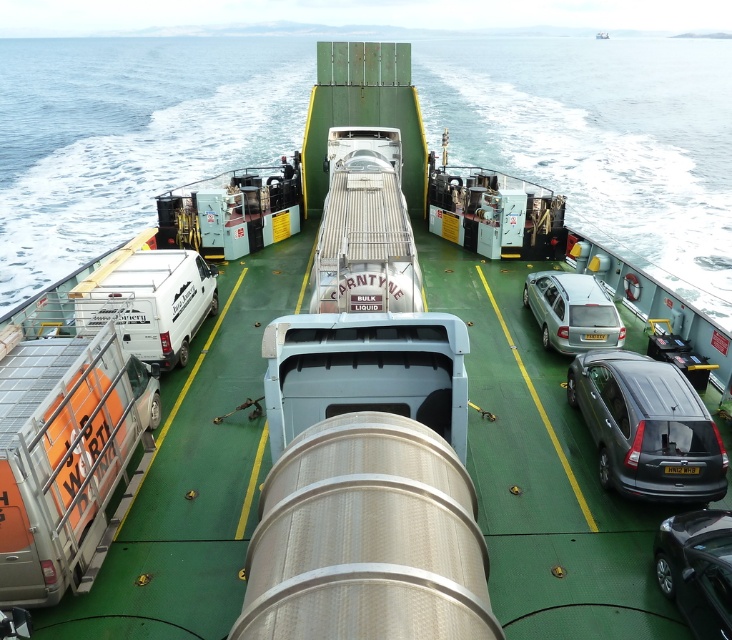
You are a passenger on the ferry and want to take a photo of the shiny black sedan at lower right and the yellow plastic license plate at center. Which object should you point your camera towards first if you want to capture both in a single shot without moving the camera?

You should point your camera towards the shiny black sedan at lower right first because it is located below the yellow plastic license plate at center, so capturing it first will ensure both are in frame.

You are a ferry operator who needs to ensure the shiny black sedan at lower right can safely pass around the clear blue water at center. Based on their sizes, is this possible?

The clear blue water at center is bigger than the shiny black sedan at lower right, so the sedan may have difficulty maneuvering around it due to the tank being larger in size.